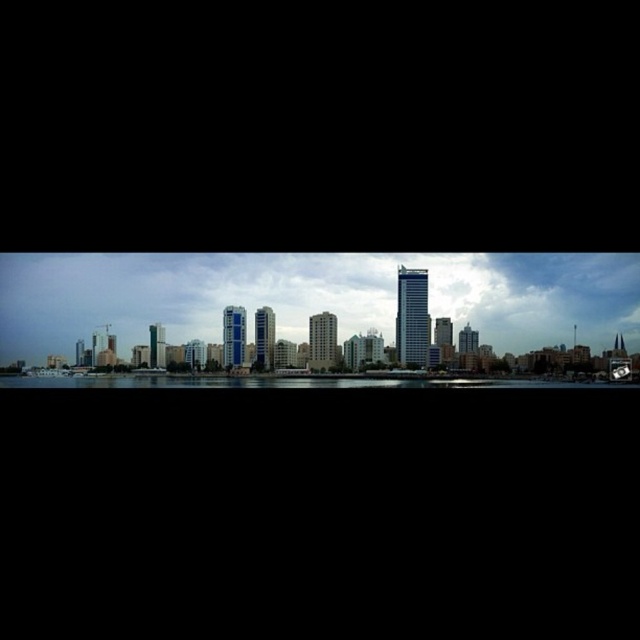
You are standing on a pier overlooking the city skyline. You notice the cloudy sky at center and the transparent glass water at center. Which object is positioned higher from your viewpoint?

The cloudy sky at center is located above the transparent glass water at center, so it is positioned higher from your viewpoint.

You are standing on a pier and want to take a photo of the cloudy sky at center and transparent glass water at center. Which object is wider in the frame?

The cloudy sky at center might be wider than transparent glass water at center according to the description.